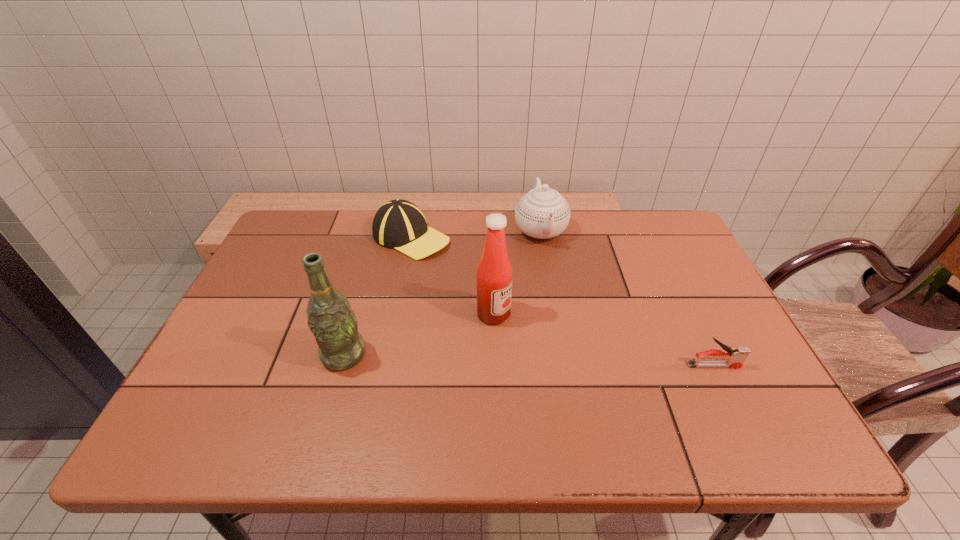
Identify the location of vacant space located 0.200m on the front-facing side of the condiment. (572, 367).

At what (x,y) coordinates should I click in order to perform the action: click on vacant space located with the brim of the baseball cap facing forward. Please return your answer as a coordinate pair (x, y). Image resolution: width=960 pixels, height=540 pixels. Looking at the image, I should click on (487, 299).

At what (x,y) coordinates should I click in order to perform the action: click on vacant space located with the brim of the baseball cap facing forward. Please return your answer as a coordinate pair (x, y). The image size is (960, 540). Looking at the image, I should click on (505, 313).

Identify the location of vacant point located with the brim of the baseball cap facing forward. The image size is (960, 540). (446, 265).

You are a GUI agent. You are given a task and a screenshot of the screen. Output one action in this format:
    pyautogui.click(x=<x>, y=<y>)
    Task: Click on the free space located on the spout of the third shortest object
    The height and width of the screenshot is (540, 960).
    Given the screenshot: What is the action you would take?
    pyautogui.click(x=581, y=362)

Identify the location of vacant area situated 0.300m on the spout of the third shortest object. (570, 329).

Where is `free region located on the spout of the third shortest object`? free region located on the spout of the third shortest object is located at coordinates (563, 303).

Find the location of `baseball cap positioned at the far edge`. baseball cap positioned at the far edge is located at coordinates pyautogui.click(x=399, y=224).

Where is `chinaware positioned at the far edge`? chinaware positioned at the far edge is located at coordinates (542, 213).

The image size is (960, 540). What are the coordinates of `object that is at the near edge` in the screenshot? It's located at (331, 320).